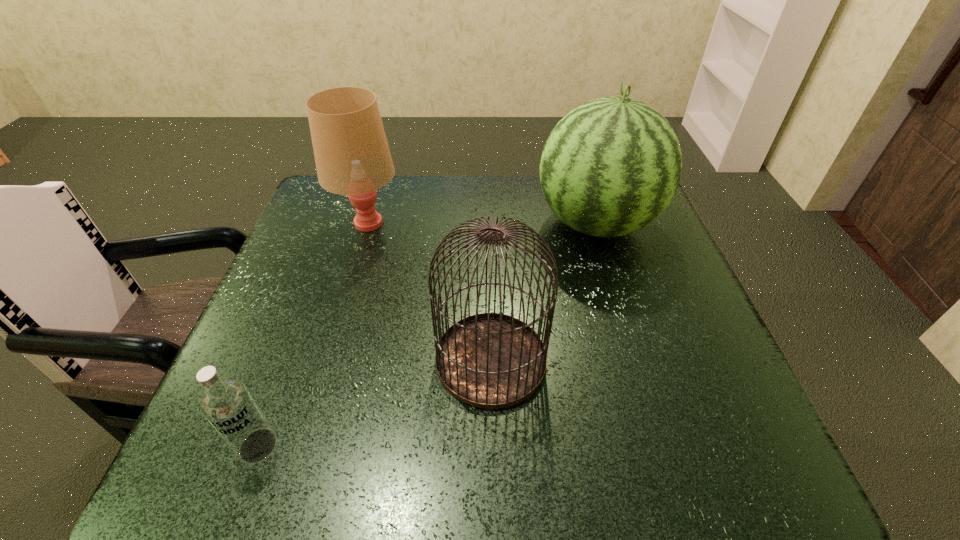
The height and width of the screenshot is (540, 960). What are the coordinates of `watermelon` in the screenshot? It's located at (611, 166).

The width and height of the screenshot is (960, 540). Find the location of `lampshade`. lampshade is located at coordinates (352, 156).

Where is `the second object from right to left`? The image size is (960, 540). the second object from right to left is located at coordinates (490, 360).

You are a GUI agent. You are given a task and a screenshot of the screen. Output one action in this format:
    pyautogui.click(x=<x>, y=<y>)
    Task: Click on the third farthest object
    
    Given the screenshot: What is the action you would take?
    pyautogui.click(x=490, y=360)

Find the location of `vodka`. vodka is located at coordinates (228, 405).

Find the location of a particular element. Image resolution: width=960 pixels, height=540 pixels. the nearest object is located at coordinates (228, 405).

This screenshot has height=540, width=960. I want to click on free space located on the left of the rightmost object, so click(x=516, y=224).

Where is `vacant space located on the back of the lampshade`? This screenshot has height=540, width=960. vacant space located on the back of the lampshade is located at coordinates (382, 177).

I want to click on vacant space situated on the left of the third farthest object, so (377, 360).

Where is `watermelon situated at the far edge`? watermelon situated at the far edge is located at coordinates (611, 166).